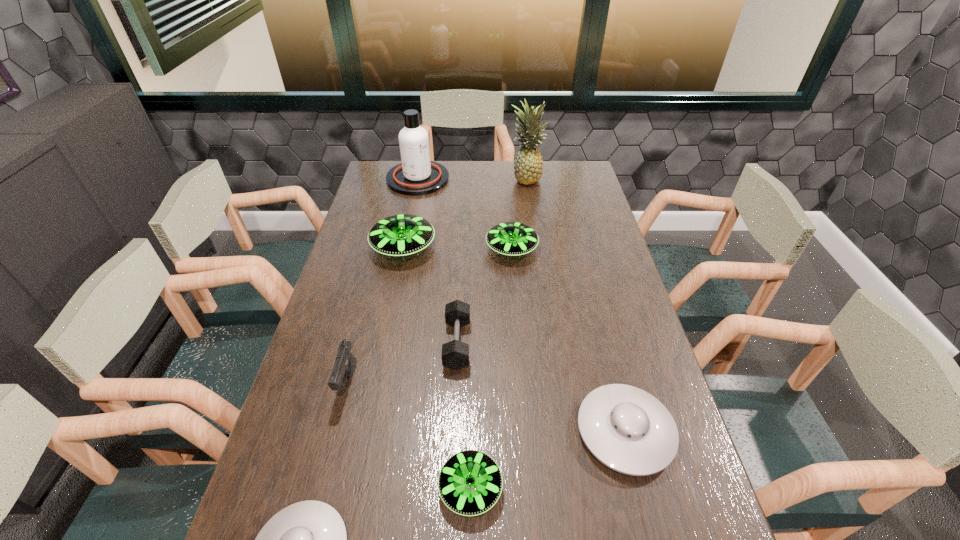
The image size is (960, 540). I want to click on pineapple, so pos(528,167).

Where is `the second tallest object`? This screenshot has height=540, width=960. the second tallest object is located at coordinates (416, 175).

This screenshot has height=540, width=960. In order to click on white cleansing agent in this screenshot , I will do `click(416, 175)`.

The image size is (960, 540). I want to click on the tallest saucer, so click(400, 235).

Image resolution: width=960 pixels, height=540 pixels. In order to click on the leftmost green saucer in this screenshot , I will do `click(400, 235)`.

Image resolution: width=960 pixels, height=540 pixels. What are the coordinates of `black pistol` in the screenshot? It's located at (345, 364).

This screenshot has height=540, width=960. I want to click on the second tallest saucer, so click(509, 238).

In order to click on dumbbell in this screenshot , I will do [455, 354].

You are a GUI agent. You are given a task and a screenshot of the screen. Output one action in this format:
    pyautogui.click(x=<x>, y=<y>)
    Task: Click on the right gray saucer
    This screenshot has width=960, height=540.
    Given the screenshot: What is the action you would take?
    pyautogui.click(x=627, y=429)

Identify the location of the farther gray saucer. The width and height of the screenshot is (960, 540). click(x=627, y=429).